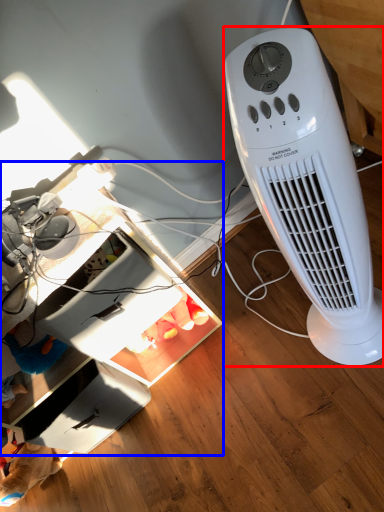
Question: Among these objects, which one is farthest to the camera, home appliance (highlighted by a red box) or computer desk (highlighted by a blue box)?

Choices:
 (A) home appliance
 (B) computer desk

Answer: (B)